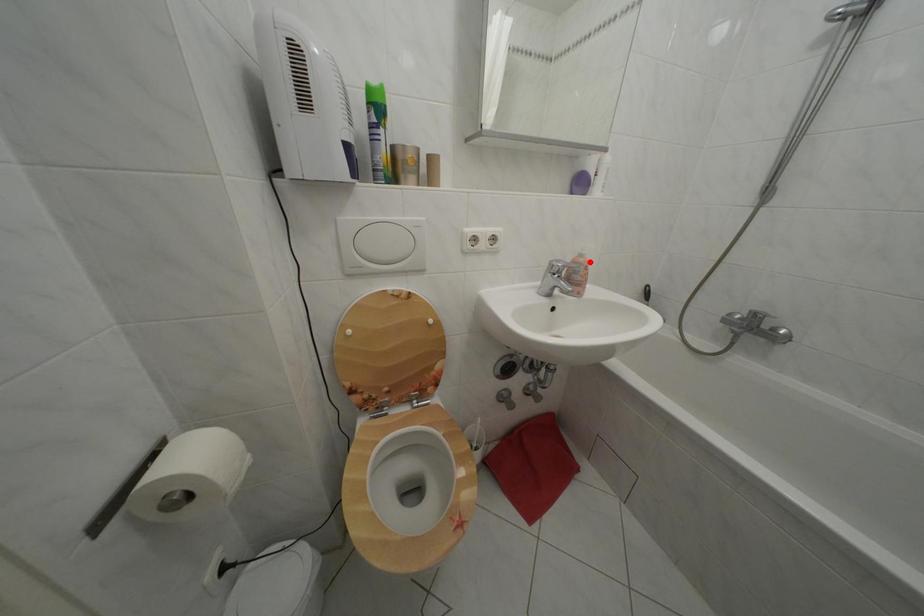
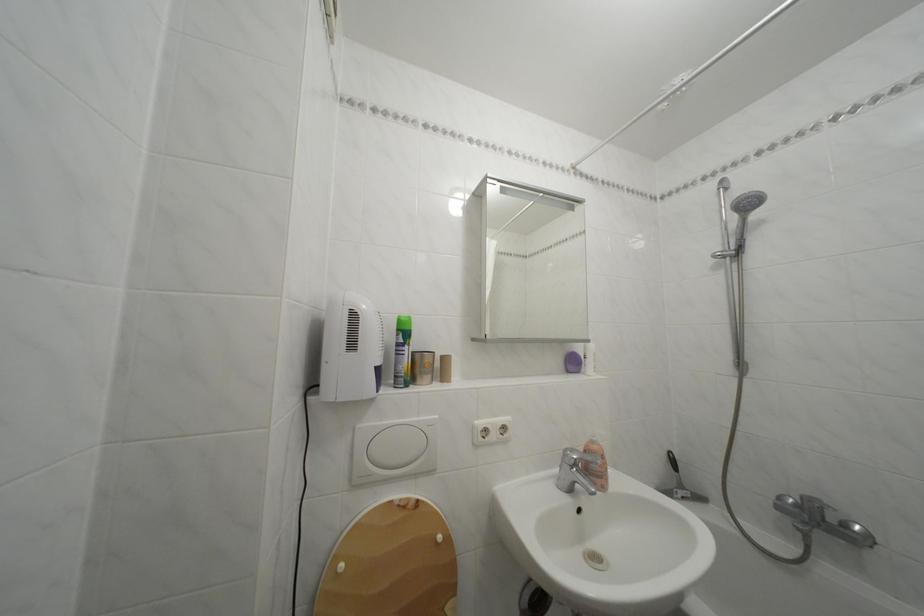
Locate, in the second image, the point that corresponds to the highlighted location in the first image.

(602, 448)